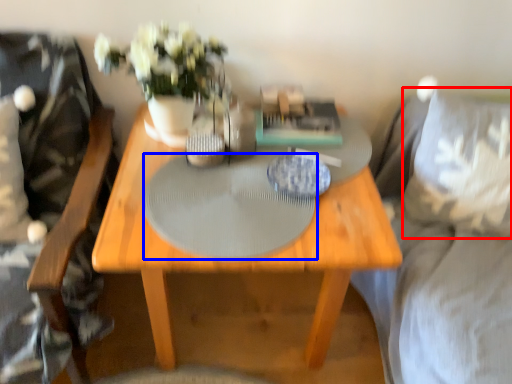
Question: Which object appears farthest to the camera in this image, pillow (highlighted by a red box) or glass table (highlighted by a blue box)?

Choices:
 (A) pillow
 (B) glass table

Answer: (A)